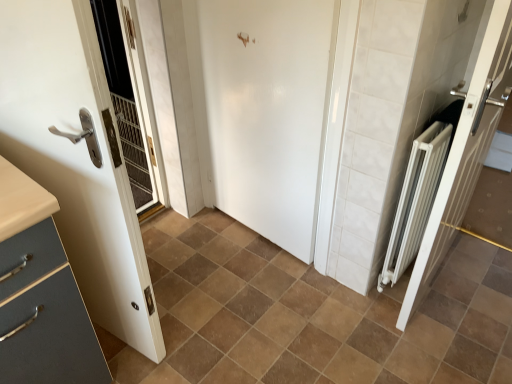
Question: Is the depth of brown matte tile at center less than that of white metallic radiator at right, the 1th door positioned from the right?

Choices:
 (A) no
 (B) yes

Answer: (A)

Question: Are brown matte tile at center and white metallic radiator at right, the 1th door positioned from the right, far apart?

Choices:
 (A) yes
 (B) no

Answer: (B)

Question: Is brown matte tile at center further to camera compared to white metallic radiator at right, placed as the third door when sorted from left to right?

Choices:
 (A) yes
 (B) no

Answer: (A)

Question: Is brown matte tile at center positioned with its back to white metallic radiator at right, placed as the third door when sorted from left to right?

Choices:
 (A) yes
 (B) no

Answer: (B)

Question: From a real-world perspective, is brown matte tile at center physically below white metallic radiator at right, the 1th door positioned from the right?

Choices:
 (A) no
 (B) yes

Answer: (B)

Question: Is brown matte tile at center smaller than white metallic radiator at right, the 1th door positioned from the right?

Choices:
 (A) yes
 (B) no

Answer: (B)

Question: Could you tell me if white glossy door at left, the 3th door in the right-to-left sequence, is turned towards white metallic radiator at right, placed as the third door when sorted from left to right?

Choices:
 (A) no
 (B) yes

Answer: (A)

Question: Can we say white glossy door at left, the 3th door in the right-to-left sequence, lies outside white metallic radiator at right, the 1th door positioned from the right?

Choices:
 (A) yes
 (B) no

Answer: (A)

Question: Can you confirm if white glossy door at left, the first door from the left, is wider than white metallic radiator at right, the 1th door positioned from the right?

Choices:
 (A) no
 (B) yes

Answer: (B)

Question: From a real-world perspective, is white glossy door at left, the first door from the left, positioned under white metallic radiator at right, placed as the third door when sorted from left to right, based on gravity?

Choices:
 (A) no
 (B) yes

Answer: (A)

Question: Considering the relative positions of white glossy door at left, the first door from the left, and white metallic radiator at right, the 1th door positioned from the right, in the image provided, is white glossy door at left, the first door from the left, to the right of white metallic radiator at right, the 1th door positioned from the right, from the viewer's perspective?

Choices:
 (A) yes
 (B) no

Answer: (B)

Question: Is white metallic radiator at right, placed as the third door when sorted from left to right, surrounded by white glossy door at left, the first door from the left?

Choices:
 (A) no
 (B) yes

Answer: (A)

Question: Is brown matte tile at center inside white glossy door at center, which is the second door from right to left?

Choices:
 (A) no
 (B) yes

Answer: (A)